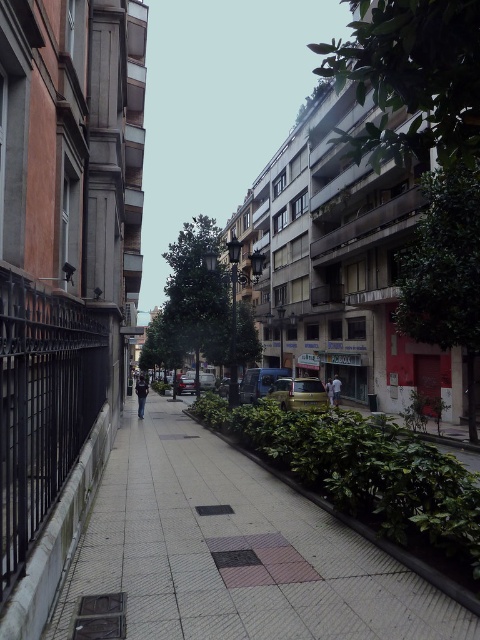
Question: Can you confirm if gray concrete sidewalk at center is positioned to the left of light blue denim jacket at center?

Choices:
 (A) yes
 (B) no

Answer: (A)

Question: Is denim jacket at center above light blue denim jacket at center?

Choices:
 (A) yes
 (B) no

Answer: (B)

Question: Which of the following is the closest to the observer?

Choices:
 (A) denim jacket at center
 (B) light blue denim jacket at center

Answer: (A)

Question: Among these points, which one is nearest to the camera?

Choices:
 (A) (334, 404)
 (B) (141, 413)

Answer: (B)

Question: Where is denim jacket at center located in relation to light blue denim jacket at center in the image?

Choices:
 (A) below
 (B) above

Answer: (A)

Question: Which point is closer to the camera?

Choices:
 (A) (312, 604)
 (B) (332, 381)
 (C) (146, 381)

Answer: (A)